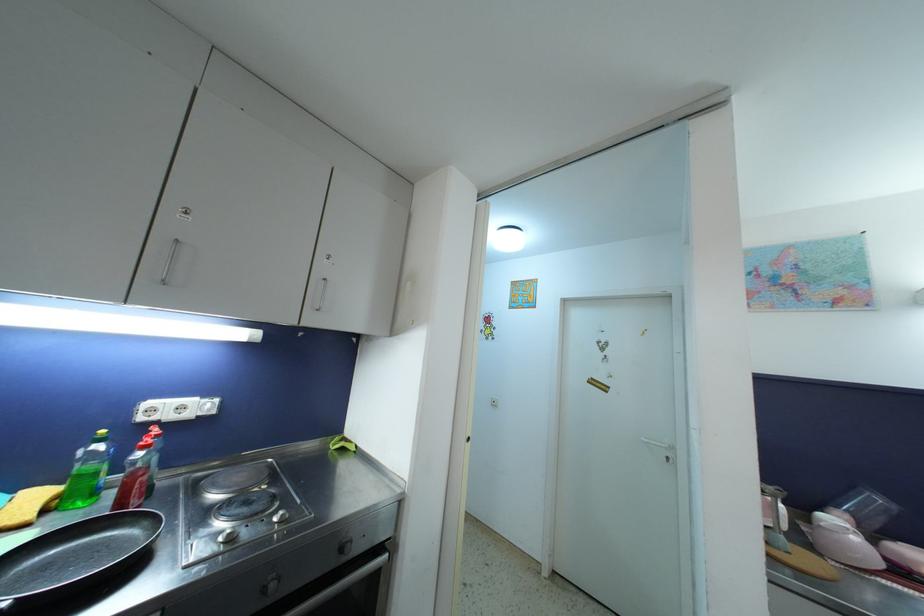
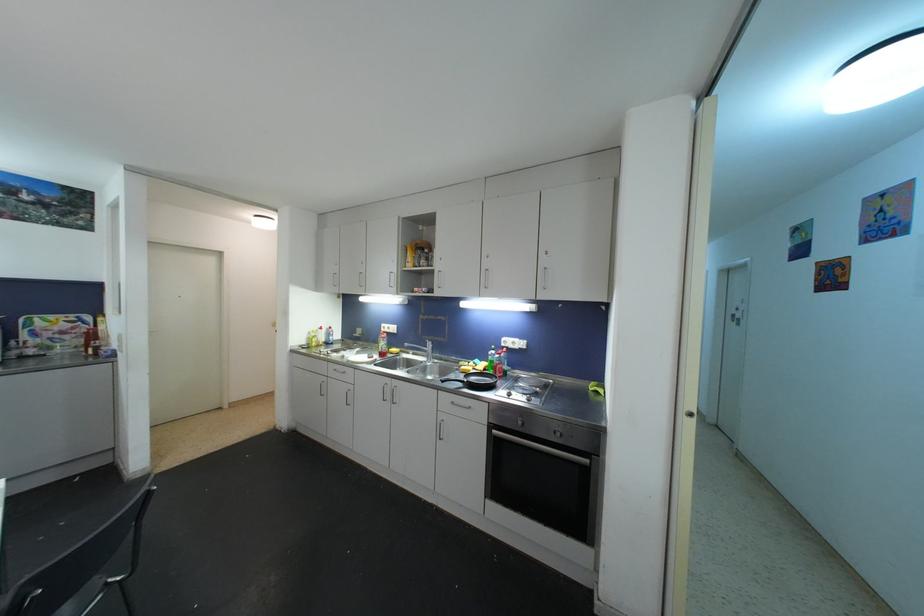
Question: The camera is either moving clockwise (left) or counter-clockwise (right) around the object. The first image is from the beginning of the video and the second image is from the end. Is the camera moving left or right when shooting the video?

Choices:
 (A) Left
 (B) Right

Answer: (B)